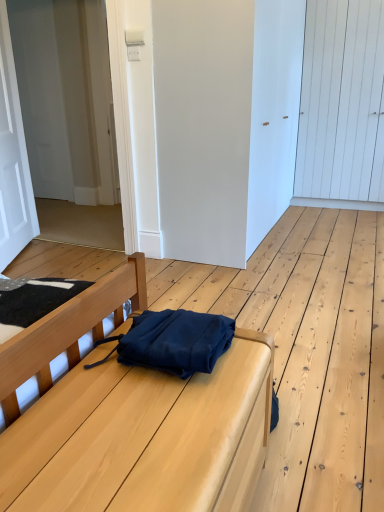
The height and width of the screenshot is (512, 384). I want to click on vacant area in front of navy blue fabric messenger bag at center, so click(x=137, y=422).